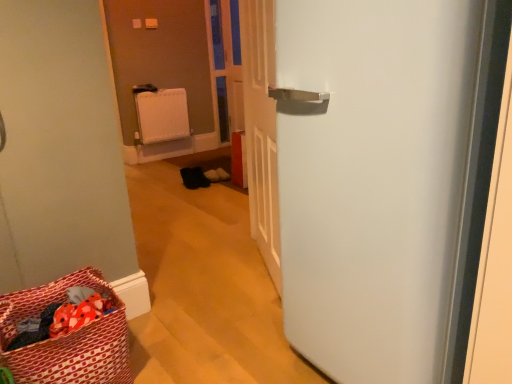
Question: Does red fabric laundry basket at lower left have a smaller size compared to white plastic radiator at center?

Choices:
 (A) no
 (B) yes

Answer: (A)

Question: Is red fabric laundry basket at lower left wider than white plastic radiator at center?

Choices:
 (A) yes
 (B) no

Answer: (A)

Question: Considering the relative positions of red fabric laundry basket at lower left and white plastic radiator at center in the image provided, is red fabric laundry basket at lower left to the left of white plastic radiator at center from the viewer's perspective?

Choices:
 (A) yes
 (B) no

Answer: (B)

Question: From the image's perspective, is red fabric laundry basket at lower left over white plastic radiator at center?

Choices:
 (A) yes
 (B) no

Answer: (B)

Question: Considering the relative positions of red fabric laundry basket at lower left and white plastic radiator at center in the image provided, is red fabric laundry basket at lower left to the right of white plastic radiator at center from the viewer's perspective?

Choices:
 (A) no
 (B) yes

Answer: (B)

Question: Is red fabric laundry basket at lower left facing towards white plastic radiator at center?

Choices:
 (A) no
 (B) yes

Answer: (A)

Question: Is red fabric laundry basket at lower left not near transparent plastic screen door at center?

Choices:
 (A) yes
 (B) no

Answer: (A)

Question: Is red fabric laundry basket at lower left facing away from transparent plastic screen door at center?

Choices:
 (A) yes
 (B) no

Answer: (B)

Question: Can we say red fabric laundry basket at lower left lies outside transparent plastic screen door at center?

Choices:
 (A) no
 (B) yes

Answer: (B)

Question: Is red fabric laundry basket at lower left in contact with transparent plastic screen door at center?

Choices:
 (A) no
 (B) yes

Answer: (A)

Question: Can you confirm if red fabric laundry basket at lower left is thinner than transparent plastic screen door at center?

Choices:
 (A) no
 (B) yes

Answer: (A)

Question: Is red fabric laundry basket at lower left at the right side of transparent plastic screen door at center?

Choices:
 (A) no
 (B) yes

Answer: (A)

Question: Is there a large distance between white matte refrigerator at right and red fabric laundry basket at lower left?

Choices:
 (A) no
 (B) yes

Answer: (A)